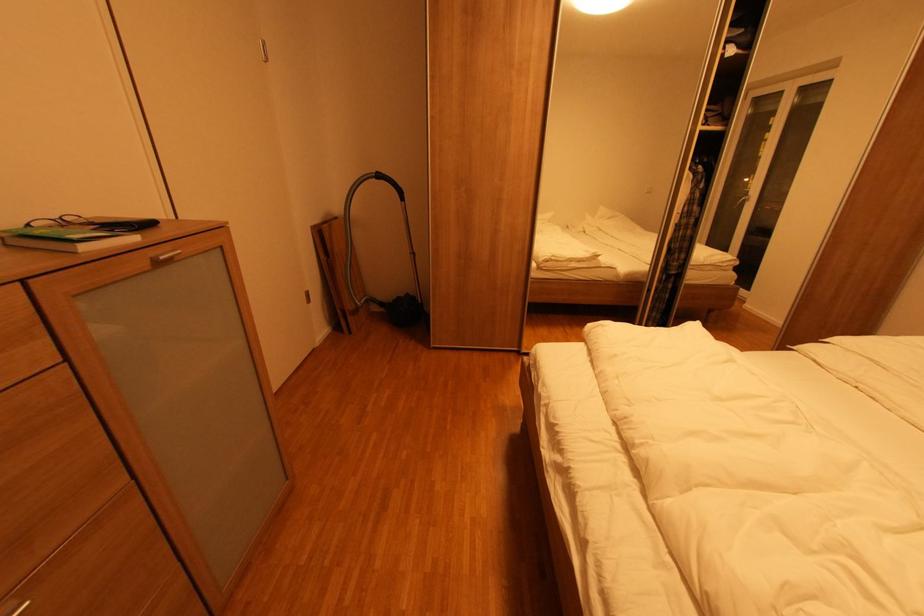
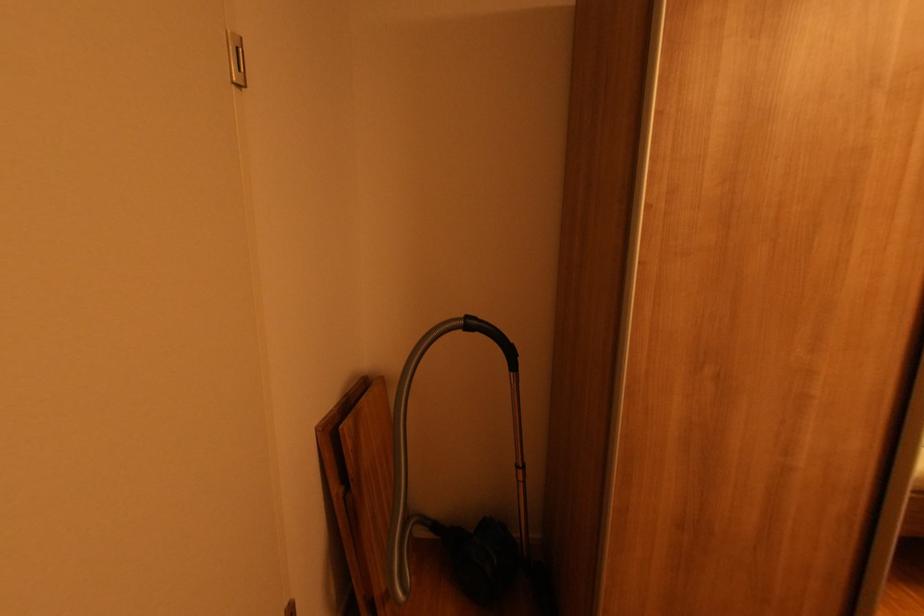
Consider the image. Which direction would the cameraman need to move to produce the second image?

The cameraman walked toward left, forward.